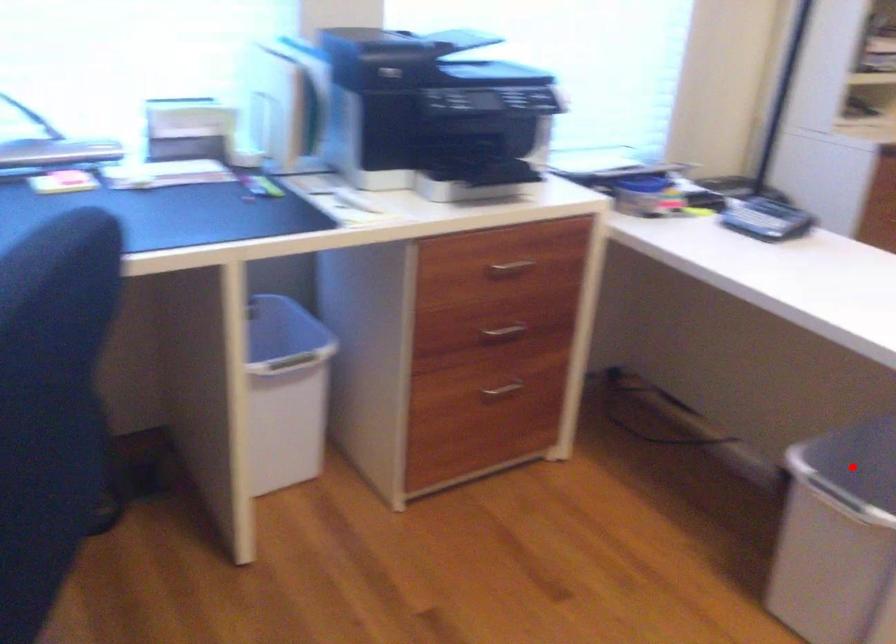
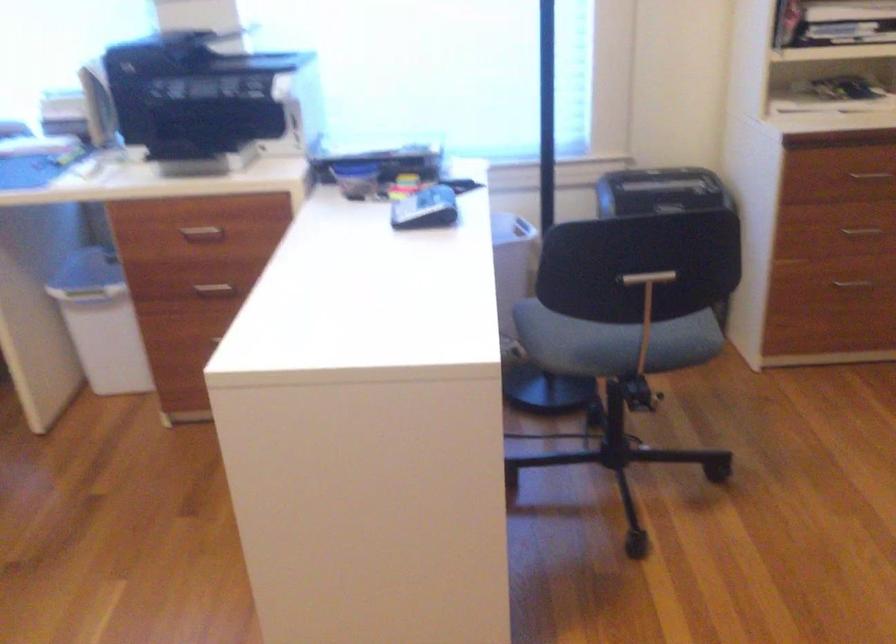
Question: I am providing you with two images of the same scene from different viewpoints. A red point is marked on the first image. Can you still see the location of the red point in image 2?

Choices:
 (A) Yes
 (B) No

Answer: (B)